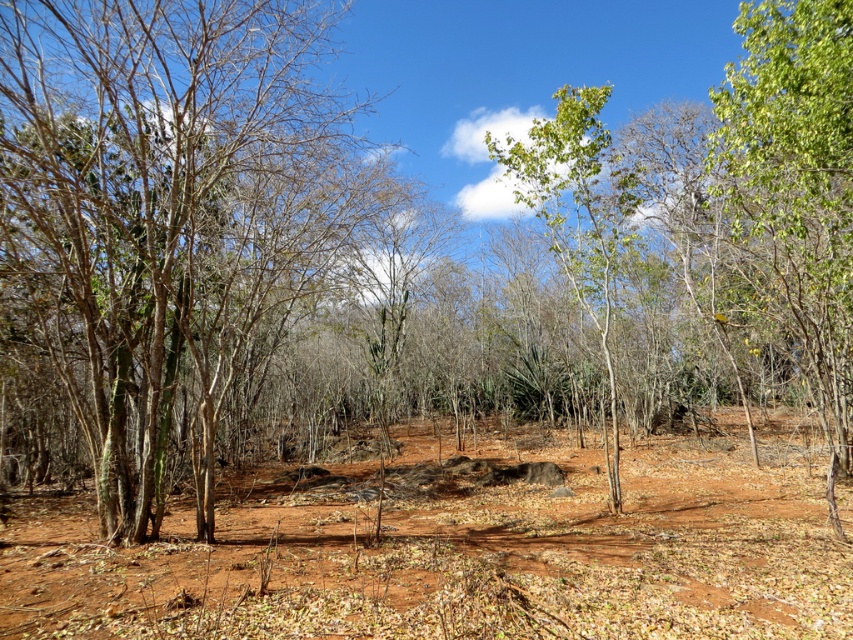
Is green leafy tree at left to the left of green leafy tree at center from the viewer's perspective?

Indeed, green leafy tree at left is positioned on the left side of green leafy tree at center.

Does green leafy tree at left appear on the right side of green leafy tree at center?

In fact, green leafy tree at left is to the left of green leafy tree at center.

Who is more forward, (120,92) or (521,195)?

Point (120,92) is in front.

Image resolution: width=853 pixels, height=640 pixels. Find the location of `green leafy tree at left`. green leafy tree at left is located at coordinates (167, 214).

What do you see at coordinates (463, 548) in the screenshot? I see `dull reddish-brown soil at center` at bounding box center [463, 548].

In order to click on dull reddish-brown soil at center in this screenshot , I will do `click(463, 548)`.

Between dull reddish-brown soil at center and green leafy tree at center, which one appears on the left side from the viewer's perspective?

From the viewer's perspective, dull reddish-brown soil at center appears more on the left side.

Who is positioned more to the right, dull reddish-brown soil at center or green leafy tree at center?

From the viewer's perspective, green leafy tree at center appears more on the right side.

Who is more distant from viewer, (231, 547) or (607, 422)?

Positioned behind is point (607, 422).

At what (x,y) coordinates should I click in order to perform the action: click on dull reddish-brown soil at center. Please return your answer as a coordinate pair (x, y). This screenshot has height=640, width=853. Looking at the image, I should click on (463, 548).